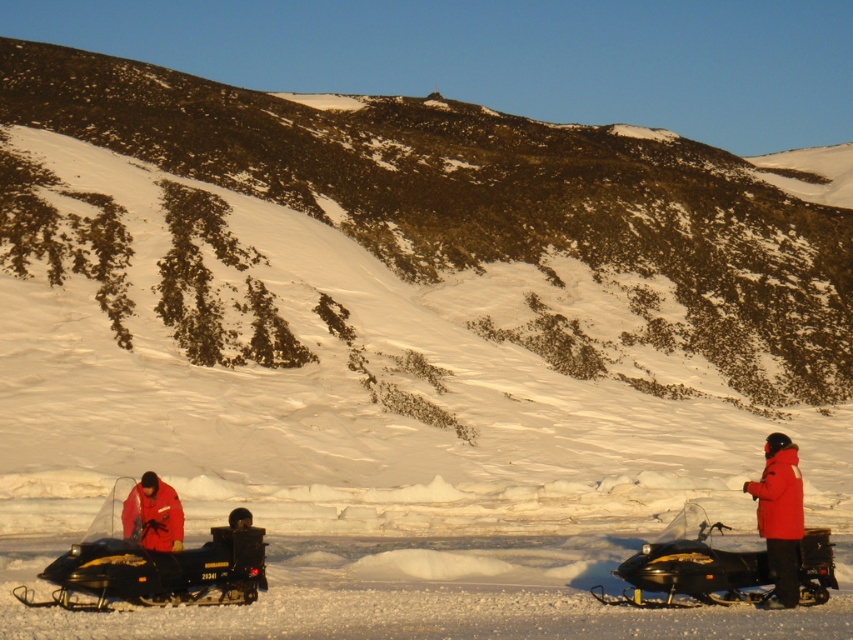
Question: Can you confirm if black plastic snowmobile at right is thinner than red matte jacket at lower left?

Choices:
 (A) yes
 (B) no

Answer: (B)

Question: Does black plastic snowmobile at right appear under red matte jacket at lower left?

Choices:
 (A) no
 (B) yes

Answer: (B)

Question: Which object is positioned farthest from the black matte snowmobile at lower left?

Choices:
 (A) black plastic snowmobile at right
 (B) red matte jacket at lower left

Answer: (A)

Question: Can you confirm if black plastic snowmobile at right is bigger than red matte jacket at lower left?

Choices:
 (A) yes
 (B) no

Answer: (A)

Question: Among these points, which one is nearest to the camera?

Choices:
 (A) (96, 532)
 (B) (787, 481)

Answer: (A)

Question: Which object is closer to the camera taking this photo?

Choices:
 (A) black plastic snowmobile at right
 (B) black matte snowmobile at lower left
 (C) red synthetic jacket at right

Answer: (B)